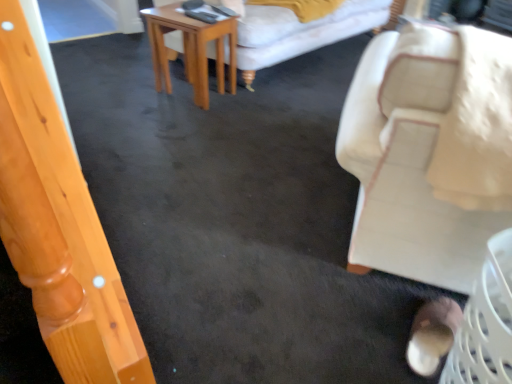
Question: Is beige fabric chair at right not near brown suede shoe at lower right?

Choices:
 (A) no
 (B) yes

Answer: (A)

Question: Is beige fabric chair at right beside brown suede shoe at lower right?

Choices:
 (A) no
 (B) yes

Answer: (A)

Question: Is beige fabric chair at right at the left side of brown suede shoe at lower right?

Choices:
 (A) no
 (B) yes

Answer: (A)

Question: Is beige fabric chair at right facing towards brown suede shoe at lower right?

Choices:
 (A) no
 (B) yes

Answer: (A)

Question: Does beige fabric chair at right have a greater width compared to brown suede shoe at lower right?

Choices:
 (A) no
 (B) yes

Answer: (B)

Question: Considering the positions of beige fabric chair at right and light brown wooden table at center in the image, is beige fabric chair at right wider or thinner than light brown wooden table at center?

Choices:
 (A) wide
 (B) thin

Answer: (A)

Question: From the image's perspective, relative to light brown wooden table at center, is beige fabric chair at right above or below?

Choices:
 (A) below
 (B) above

Answer: (A)

Question: Looking at the image, does beige fabric chair at right seem bigger or smaller compared to light brown wooden table at center?

Choices:
 (A) big
 (B) small

Answer: (A)

Question: Considering the relative positions of beige fabric chair at right and light brown wooden table at center in the image provided, is beige fabric chair at right to the left or to the right of light brown wooden table at center?

Choices:
 (A) left
 (B) right

Answer: (B)

Question: In terms of height, does light brown wooden table at center look taller or shorter compared to beige fabric chair at right?

Choices:
 (A) short
 (B) tall

Answer: (A)

Question: Considering the positions of light brown wooden table at center and beige fabric chair at right in the image, is light brown wooden table at center bigger or smaller than beige fabric chair at right?

Choices:
 (A) small
 (B) big

Answer: (A)

Question: Relative to beige fabric chair at right, is light brown wooden table at center in front or behind?

Choices:
 (A) front
 (B) behind

Answer: (B)

Question: From a real-world perspective, is light brown wooden table at center positioned above or below beige fabric chair at right?

Choices:
 (A) below
 (B) above

Answer: (A)

Question: From their relative heights in the image, would you say beige fabric chair at right is taller or shorter than brown suede shoe at lower right?

Choices:
 (A) tall
 (B) short

Answer: (A)

Question: Would you say beige fabric chair at right is inside or outside brown suede shoe at lower right?

Choices:
 (A) inside
 (B) outside

Answer: (B)